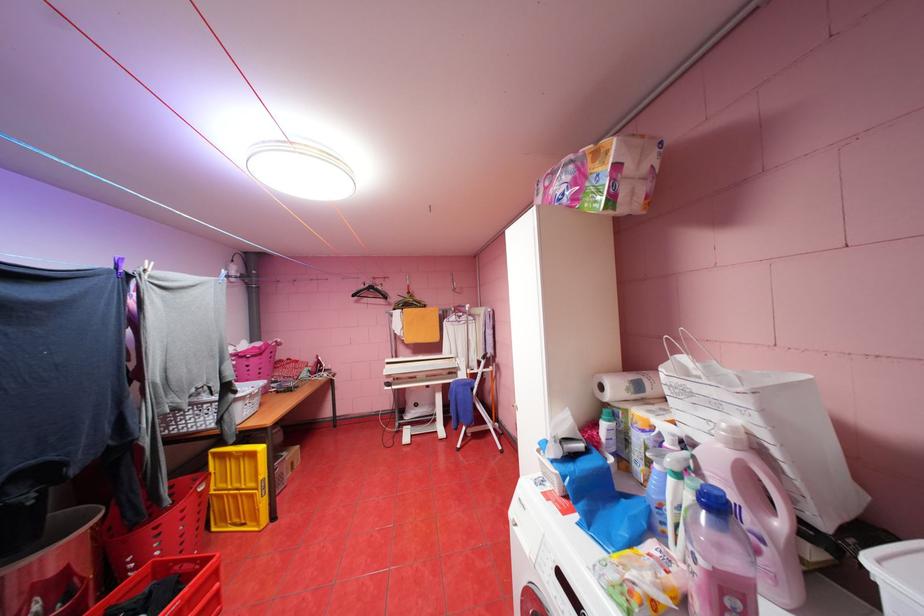
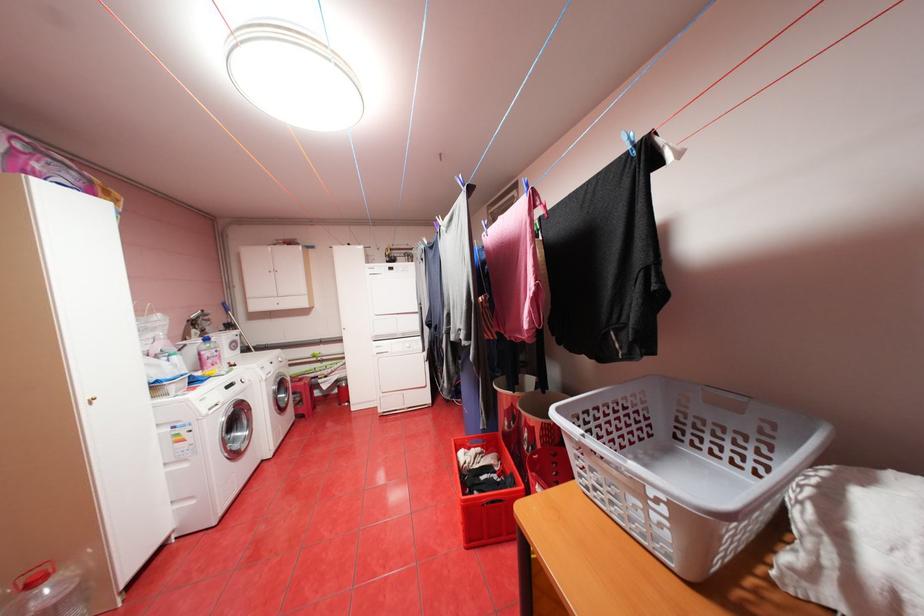
Question: I am providing you with two images of the same scene from different viewpoints. Please identify which objects are invisible in image2.

Choices:
 (A) red laundry hamper
 (B) grey basket handle
 (C) purple and yellow book
 (D) paper towel roll

Answer: (D)